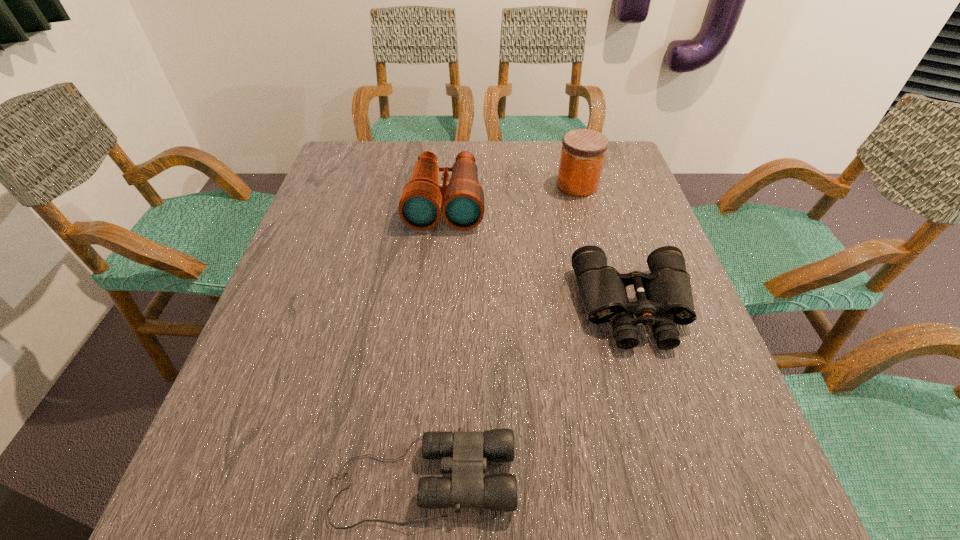
You are a GUI agent. You are given a task and a screenshot of the screen. Output one action in this format:
    pyautogui.click(x=<x>, y=<y>)
    Task: Click on the free spot between the second farthest binoculars and the jar
    
    Given the screenshot: What is the action you would take?
    pyautogui.click(x=606, y=246)

You are a GUI agent. You are given a task and a screenshot of the screen. Output one action in this format:
    pyautogui.click(x=<x>, y=<y>)
    Task: Click on the vacant space in between the farthest binoculars and the nearest binoculars
    This screenshot has width=960, height=540.
    Given the screenshot: What is the action you would take?
    pyautogui.click(x=434, y=341)

I want to click on free space between the tallest object and the second nearest binoculars, so click(606, 246).

Identify which object is the second closest to the jar. Please provide its 2D coordinates. Your answer should be formatted as a tuple, i.e. [(x, y)], where the tuple contains the x and y coordinates of a point satisfying the conditions above.

[(664, 297)]

This screenshot has height=540, width=960. What are the coordinates of `the third closest object relative to the tallest object` in the screenshot? It's located at click(464, 453).

Identify which binoculars is located as the nearest to the third shortest object. Please provide its 2D coordinates. Your answer should be formatted as a tuple, i.e. [(x, y)], where the tuple contains the x and y coordinates of a point satisfying the conditions above.

[(664, 297)]

Identify the location of binoculars that is the third closest one to the tallest object. coord(464,453).

Identify the location of free location that satisfies the following two spatial constraints: 1. through the eyepieces of the second nearest binoculars; 2. at the eyepiece of the nearest object. This screenshot has height=540, width=960. (688, 480).

I want to click on free space that satisfies the following two spatial constraints: 1. through the eyepieces of the second farthest binoculars; 2. at the eyepiece of the shortest object, so click(x=688, y=480).

The image size is (960, 540). I want to click on vacant region that satisfies the following two spatial constraints: 1. through the eyepieces of the second nearest binoculars; 2. at the eyepiece of the nearest object, so click(x=688, y=480).